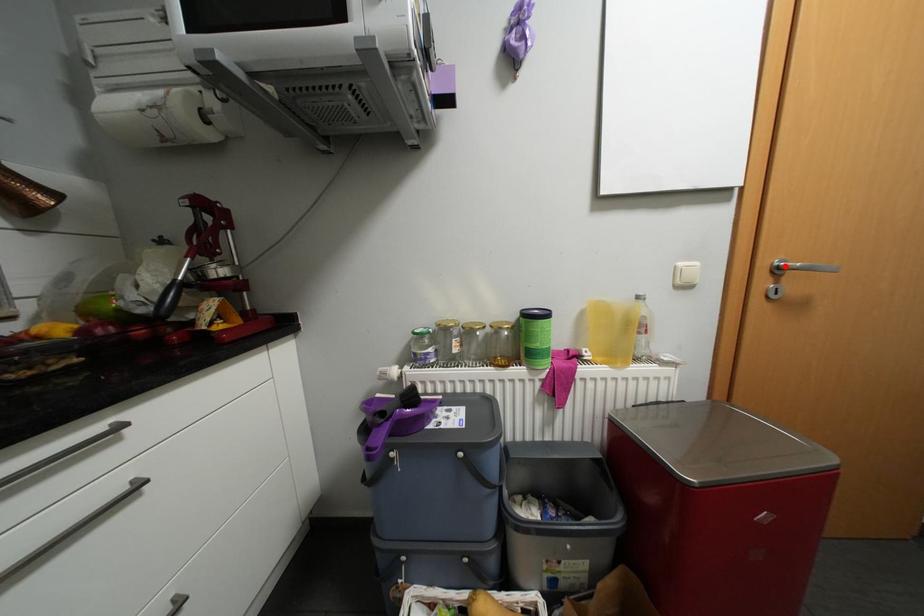
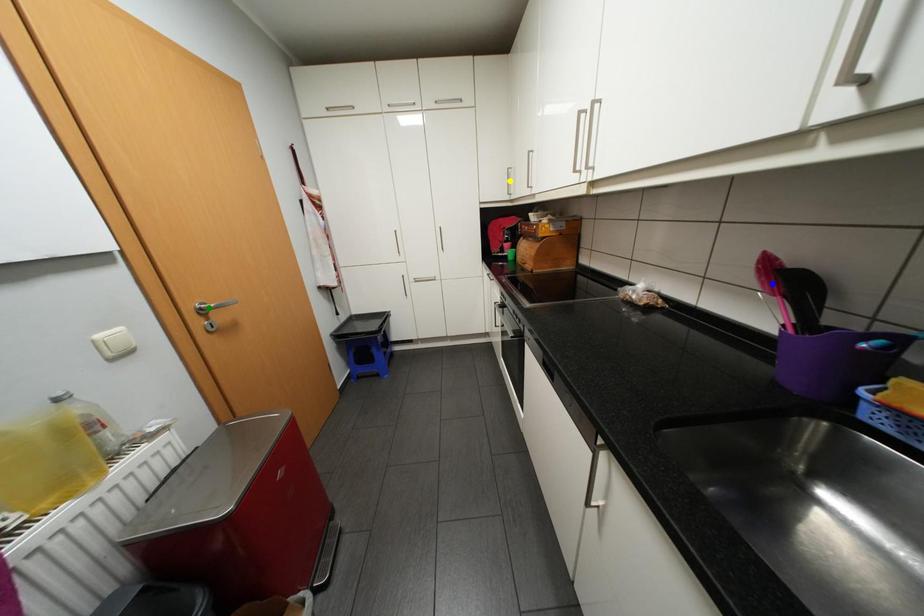
Question: I am providing you with two images of the same scene from different viewpoints. A red point is marked on the first image. You are given multiple points on the second image. Which point in image 2 represents the same 3d spot as the red point in image 1?

Choices:
 (A) blue point
 (B) green point
 (C) yellow point

Answer: (B)